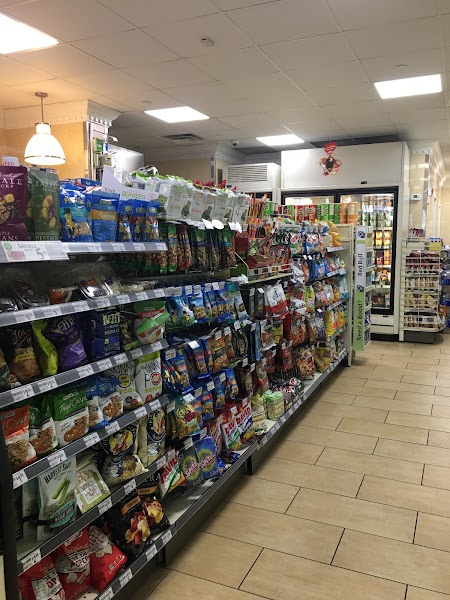
Locate an element on the screen. This screenshot has height=600, width=450. light is located at coordinates (20, 27), (43, 156), (171, 109), (274, 140), (414, 88).